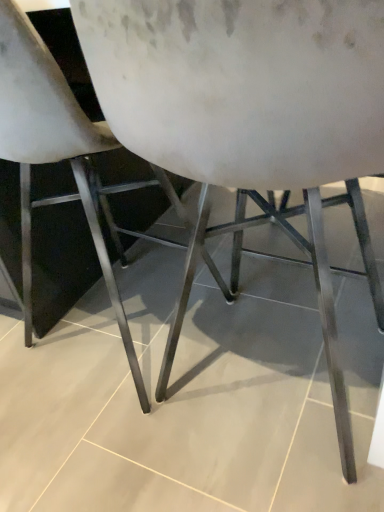
Question: Should I look upward or downward to see white matte chair at center?

Choices:
 (A) down
 (B) up

Answer: (B)